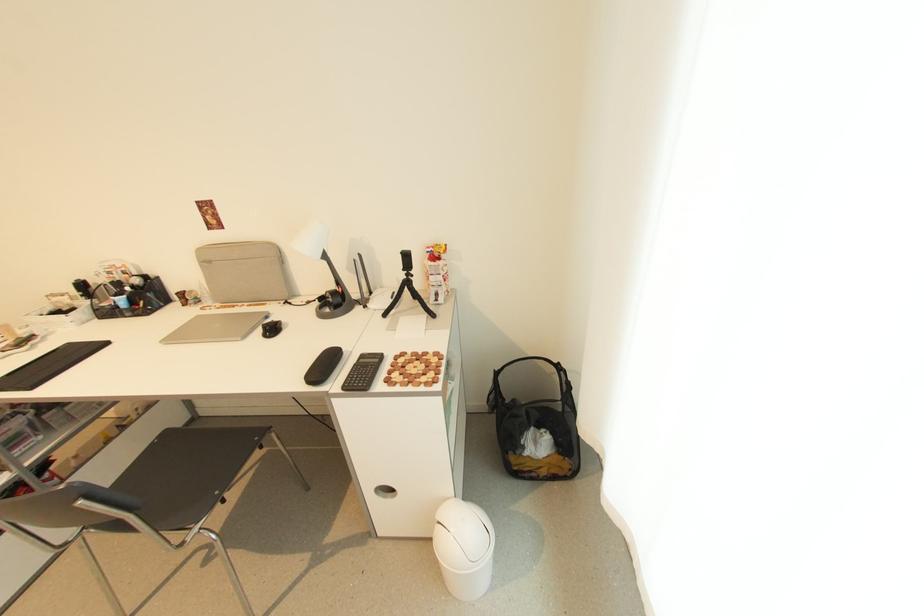
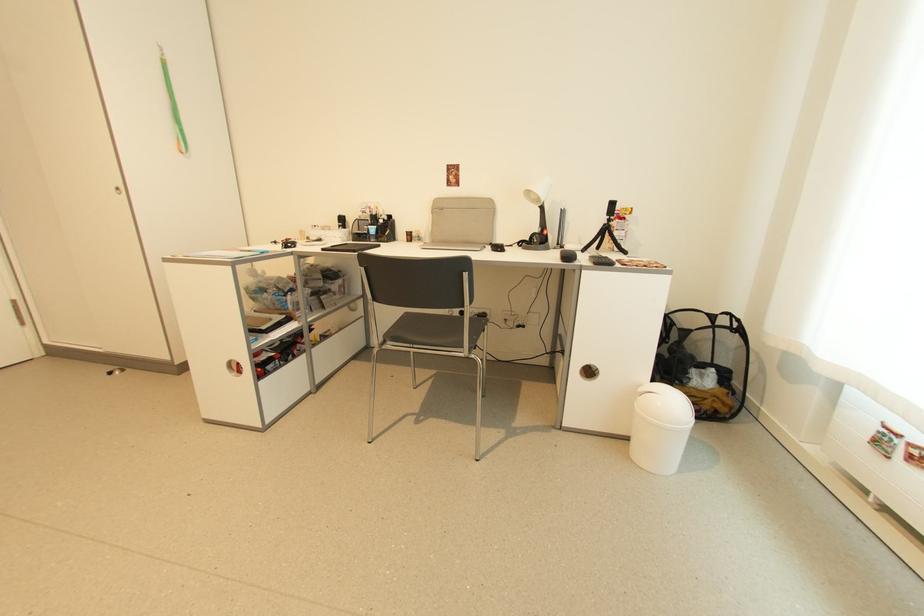
Locate, in the second image, the point that corresponds to point 408,270 in the first image.

(612, 217)